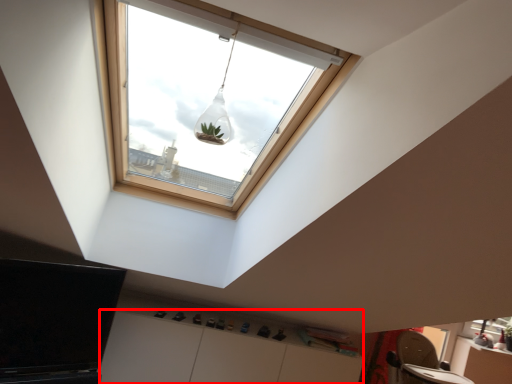
Question: From the image's perspective, where is cabinetry (annotated by the red box) located in relation to light fixture in the image?

Choices:
 (A) below
 (B) above

Answer: (A)